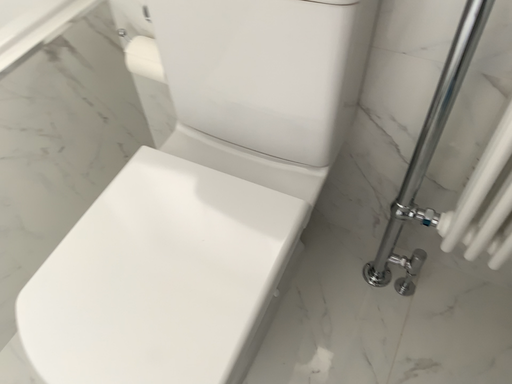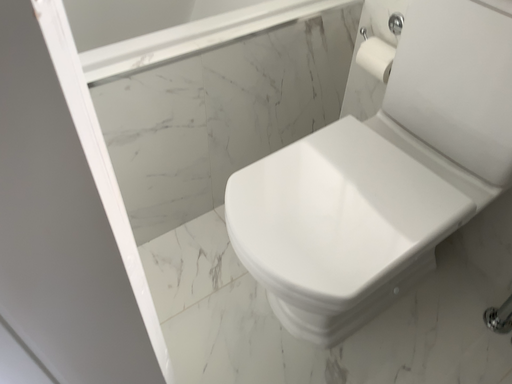
Question: How did the camera likely rotate when shooting the video?

Choices:
 (A) rotated downward
 (B) rotated upward

Answer: (B)